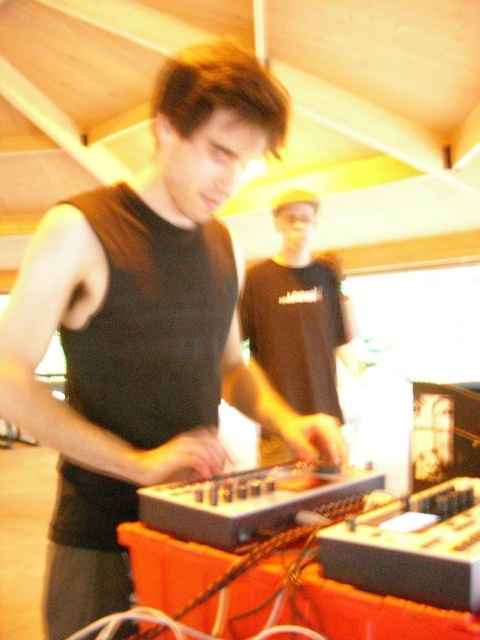
Does black matte tank top at center appear on the right side of black plastic mixer at center?

Incorrect, black matte tank top at center is not on the right side of black plastic mixer at center.

Which of these two, black matte tank top at center or black plastic mixer at center, stands taller?

Standing taller between the two is black matte tank top at center.

Is point (132, 202) behind point (230, 480)?

Yes, point (132, 202) is behind point (230, 480).

I want to click on black matte tank top at center, so click(x=145, y=328).

How far apart are black matte tank top at center and black matte shirt at center?

They are 1.21 meters apart.

Does black matte tank top at center lie behind black matte shirt at center?

No, it is not.

Between point (213, 170) and point (339, 419), which one is positioned in front?

Positioned in front is point (213, 170).

Where is `black matte tank top at center`? black matte tank top at center is located at coordinates (145, 328).

The width and height of the screenshot is (480, 640). In order to click on black matte shirt at center in this screenshot , I will do `click(297, 312)`.

Is point (299, 209) in front of point (330, 477)?

That is False.

Identify the location of black matte shirt at center. Image resolution: width=480 pixels, height=640 pixels. (297, 312).